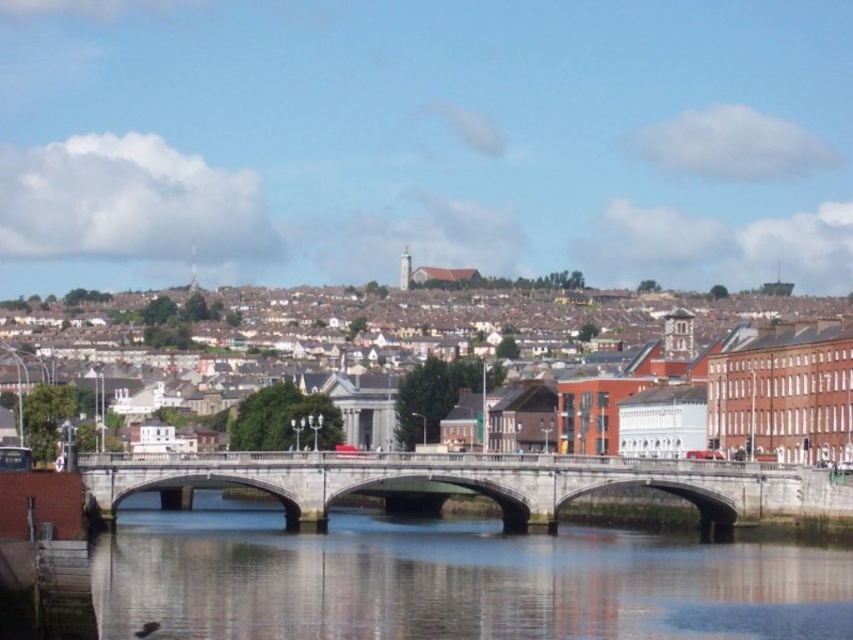
Between matte brick town at upper center and concrete bridge at center, which one appears on the left side from the viewer's perspective?

concrete bridge at center

Which is in front, point (764, 310) or point (498, 458)?

Positioned in front is point (498, 458).

The height and width of the screenshot is (640, 853). What do you see at coordinates (392, 317) in the screenshot? I see `matte brick town at upper center` at bounding box center [392, 317].

You are a GUI agent. You are given a task and a screenshot of the screen. Output one action in this format:
    pyautogui.click(x=<x>, y=<y>)
    Task: Click on the matte brick town at upper center
    This screenshot has width=853, height=640.
    Given the screenshot: What is the action you would take?
    pyautogui.click(x=392, y=317)

Can you confirm if clear water at center is thinner than concrete bridge at center?

No.

Who is positioned more to the right, clear water at center or concrete bridge at center?

clear water at center

The image size is (853, 640). Identify the location of clear water at center. (450, 580).

Find the location of a particular element. This screenshot has height=640, width=853. clear water at center is located at coordinates (450, 580).

Which is in front, point (497, 573) or point (326, 292)?

Point (497, 573) is more forward.

Is point (692, 602) positioned after point (485, 332)?

No, (692, 602) is in front of (485, 332).

Where is `clear water at center`? clear water at center is located at coordinates (450, 580).